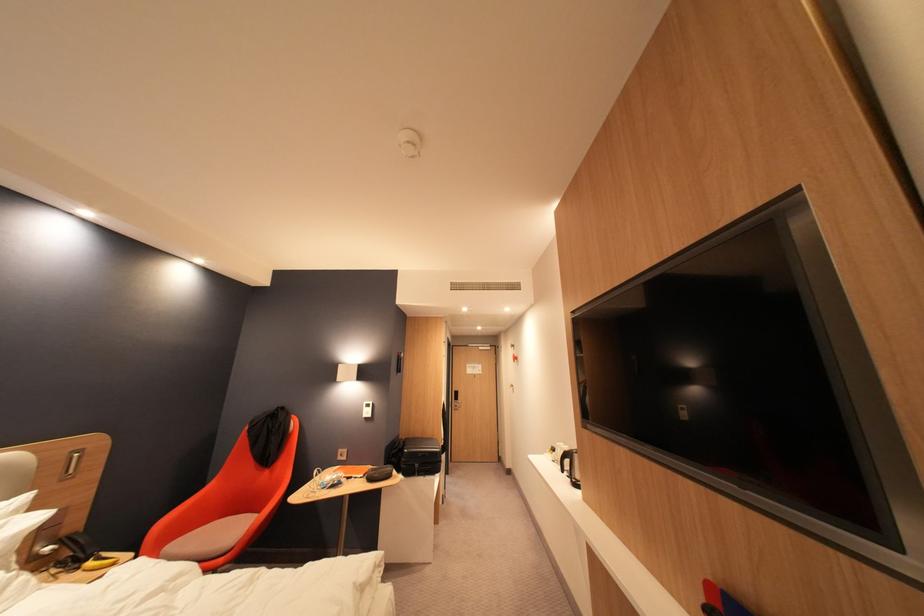
Locate an element on the screen. The width and height of the screenshot is (924, 616). white light switch is located at coordinates (368, 410).